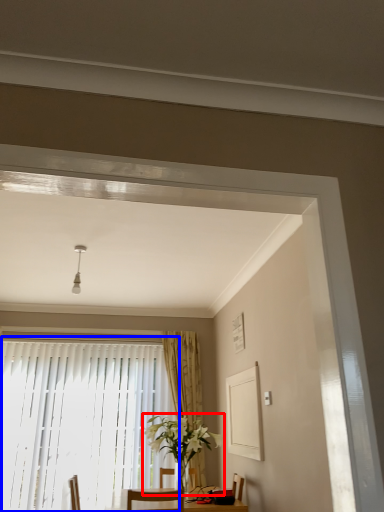
Question: Which object appears closest to the camera in this image, houseplant (highlighted by a red box) or window (highlighted by a blue box)?

Choices:
 (A) houseplant
 (B) window

Answer: (A)